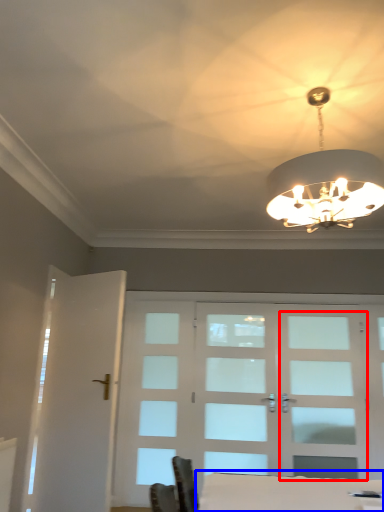
Question: Which object appears closest to the camera in this image, screen door (highlighted by a red box) or table (highlighted by a blue box)?

Choices:
 (A) screen door
 (B) table

Answer: (B)